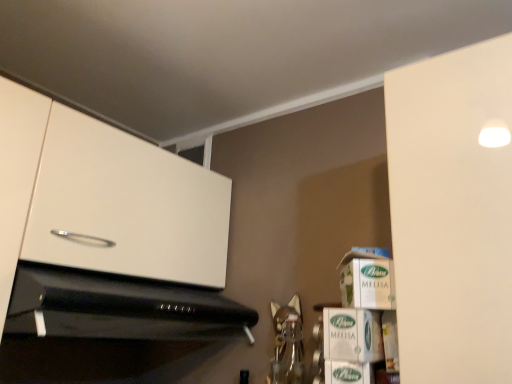
Question: Considering the relative sizes of white cardboard box at right, which is the 1th cardboard box from top to bottom, and black glossy microwave at lower left in the image provided, is white cardboard box at right, which is the 1th cardboard box from top to bottom, wider than black glossy microwave at lower left?

Choices:
 (A) no
 (B) yes

Answer: (A)

Question: Can you confirm if white cardboard box at right, which is the 1th cardboard box from top to bottom, is positioned to the right of black glossy microwave at lower left?

Choices:
 (A) yes
 (B) no

Answer: (A)

Question: Is white cardboard box at right, the third cardboard box positioned from the bottom, oriented away from black glossy microwave at lower left?

Choices:
 (A) no
 (B) yes

Answer: (A)

Question: Is white cardboard box at right, which is the 1th cardboard box from top to bottom, thinner than black glossy microwave at lower left?

Choices:
 (A) no
 (B) yes

Answer: (B)

Question: From a real-world perspective, is white cardboard box at right, which is the 1th cardboard box from top to bottom, physically below black glossy microwave at lower left?

Choices:
 (A) no
 (B) yes

Answer: (A)

Question: Is white cardboard box at right, the third cardboard box positioned from the bottom, beside black glossy microwave at lower left?

Choices:
 (A) no
 (B) yes

Answer: (A)

Question: From a real-world perspective, is white glossy cabinet at upper left physically above green cardboard box at lower right, arranged as the third cardboard box when viewed from the top?

Choices:
 (A) yes
 (B) no

Answer: (A)

Question: Can you confirm if white glossy cabinet at upper left is wider than green cardboard box at lower right, arranged as the third cardboard box when viewed from the top?

Choices:
 (A) yes
 (B) no

Answer: (A)

Question: Is white glossy cabinet at upper left at the right side of green cardboard box at lower right, marked as the 1th cardboard box in a bottom-to-top arrangement?

Choices:
 (A) yes
 (B) no

Answer: (B)

Question: Are white glossy cabinet at upper left and green cardboard box at lower right, marked as the 1th cardboard box in a bottom-to-top arrangement, beside each other?

Choices:
 (A) no
 (B) yes

Answer: (A)

Question: Can you confirm if white glossy cabinet at upper left is thinner than green cardboard box at lower right, arranged as the third cardboard box when viewed from the top?

Choices:
 (A) no
 (B) yes

Answer: (A)

Question: From the image's perspective, would you say white glossy cabinet at upper left is positioned over green cardboard box at lower right, arranged as the third cardboard box when viewed from the top?

Choices:
 (A) yes
 (B) no

Answer: (A)

Question: Are green cardboard box at lower right, positioned as the 2th cardboard box in bottom-to-top order, and green cardboard box at lower right, marked as the 1th cardboard box in a bottom-to-top arrangement, far apart?

Choices:
 (A) yes
 (B) no

Answer: (B)